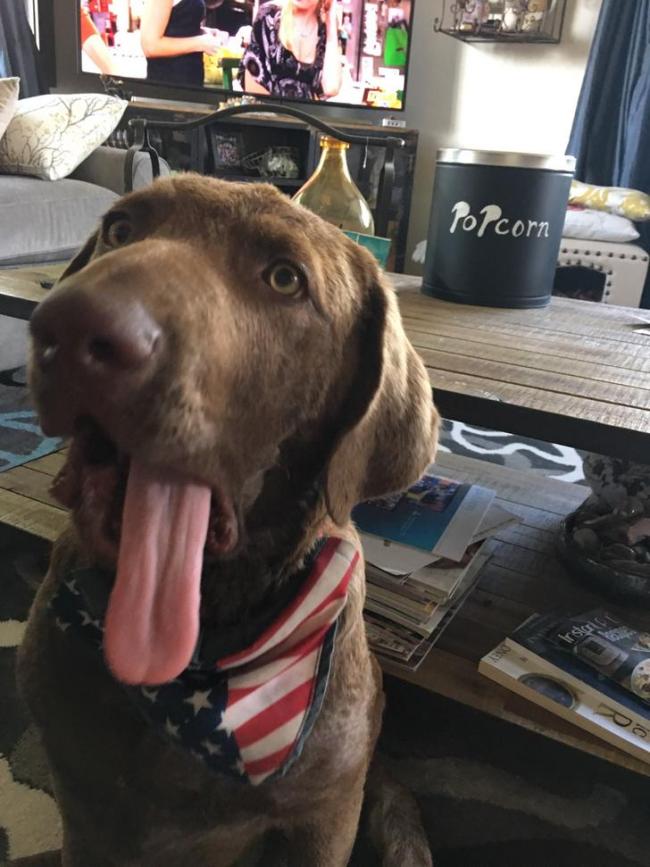
Where is `vase in background far right center`? vase in background far right center is located at coordinates (619, 531).